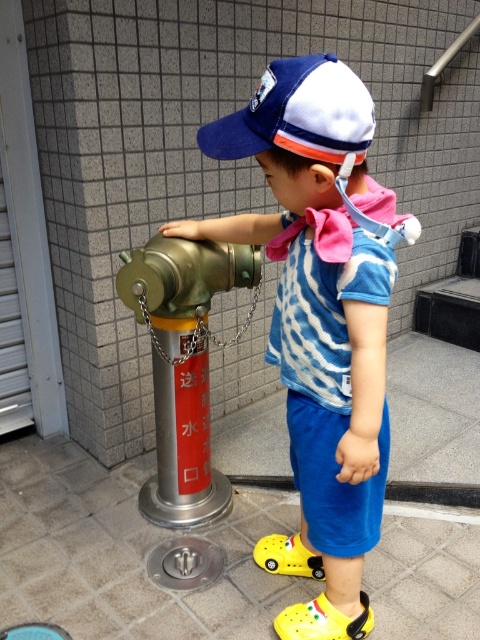
Question: Is metallic hydrant at center bigger than blue/white mesh baseball cap at upper center?

Choices:
 (A) no
 (B) yes

Answer: (B)

Question: Which point is farther to the camera?

Choices:
 (A) (240, 116)
 (B) (170, 451)

Answer: (B)

Question: Which point is closer to the camera?

Choices:
 (A) (168, 225)
 (B) (304, 156)

Answer: (B)

Question: Is blue cotton shirt at center wider than blue/white mesh baseball cap at upper center?

Choices:
 (A) no
 (B) yes

Answer: (B)

Question: Which object appears farthest from the camera in this image?

Choices:
 (A) metallic hydrant at center
 (B) blue cotton shirt at center
 (C) blue/white mesh baseball cap at upper center

Answer: (A)

Question: In this image, where is metallic hydrant at center located relative to blue/white mesh baseball cap at upper center?

Choices:
 (A) right
 (B) left

Answer: (B)